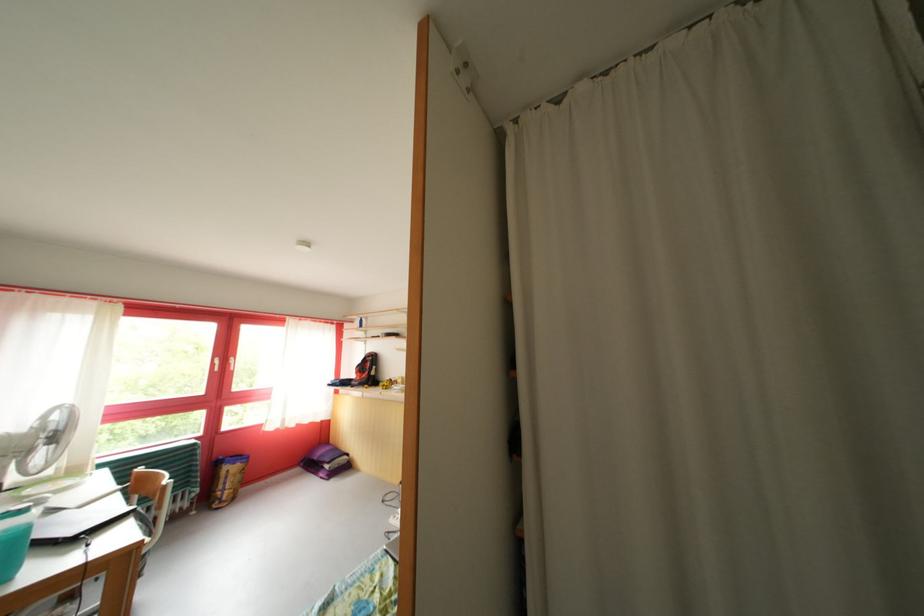
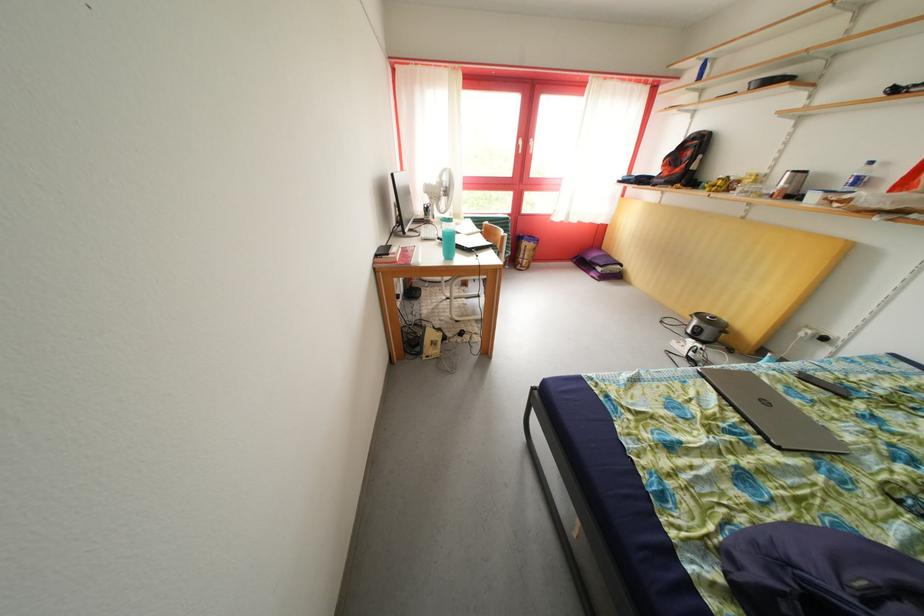
Where in the second image is the point corresponding to (225,368) from the first image?

(528, 148)